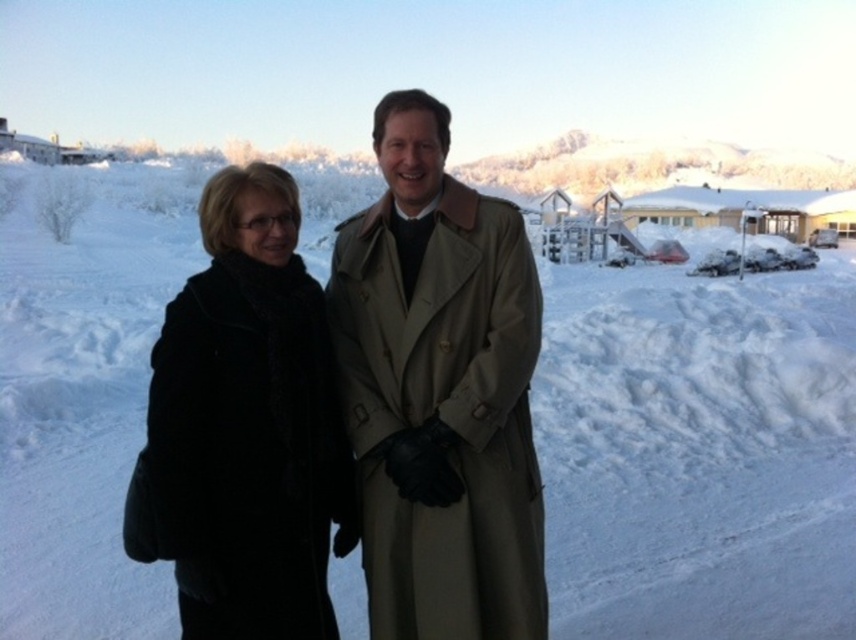
Is point (318, 561) positioned behind point (531, 625)?

Yes, it is behind point (531, 625).

Which is above, black wool coat at left or beige leather trench coat at center?

black wool coat at left

Between point (268, 525) and point (370, 298), which one is positioned in front?

Point (268, 525) is more forward.

At what (x,y) coordinates should I click in order to perform the action: click on black wool coat at left. Please return your answer as a coordinate pair (x, y). This screenshot has height=640, width=856. Looking at the image, I should click on (245, 428).

Does black wool coat at center have a lesser height compared to black wool coat at left?

Correct, black wool coat at center is not as tall as black wool coat at left.

Between point (336, 352) and point (292, 595), which one is positioned in front?

Point (292, 595) is more forward.

Between point (504, 253) and point (218, 323), which one is positioned in front?

Positioned in front is point (218, 323).

Identify the location of black wool coat at center. (440, 392).

Who is lower down, black wool coat at center or beige leather trench coat at center?

black wool coat at center

At what (x,y) coordinates should I click in order to perform the action: click on black wool coat at center. Please return your answer as a coordinate pair (x, y). Looking at the image, I should click on (440, 392).

You are a GUI agent. You are given a task and a screenshot of the screen. Output one action in this format:
    pyautogui.click(x=<x>, y=<y>)
    Task: Click on the black wool coat at center
    
    Given the screenshot: What is the action you would take?
    pyautogui.click(x=440, y=392)